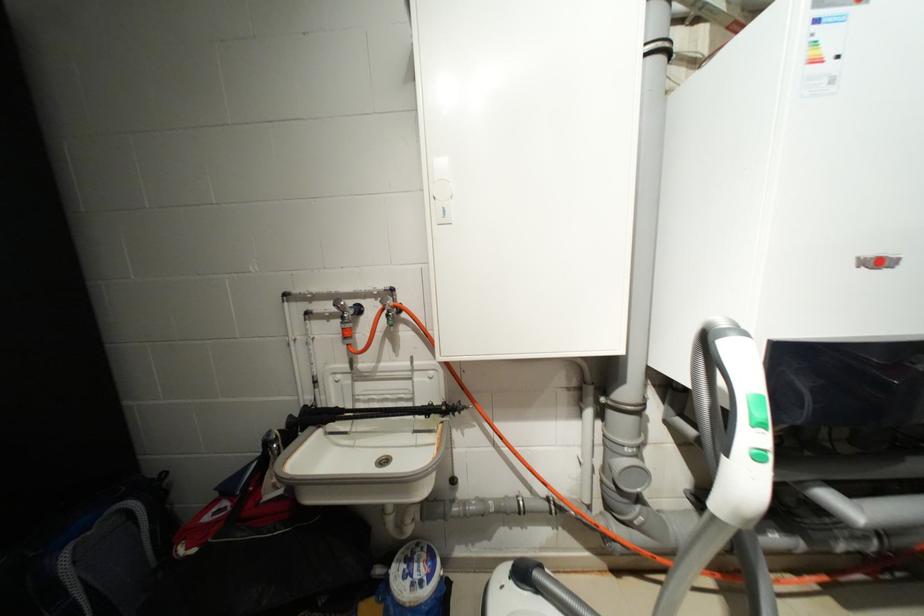
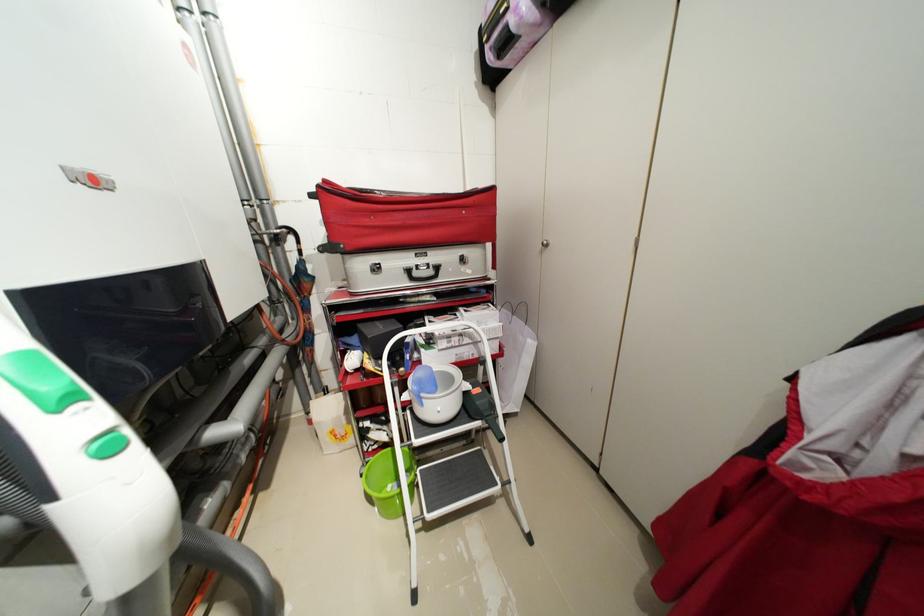
In the second image, find the point that corresponds to (764,459) in the first image.

(117, 454)